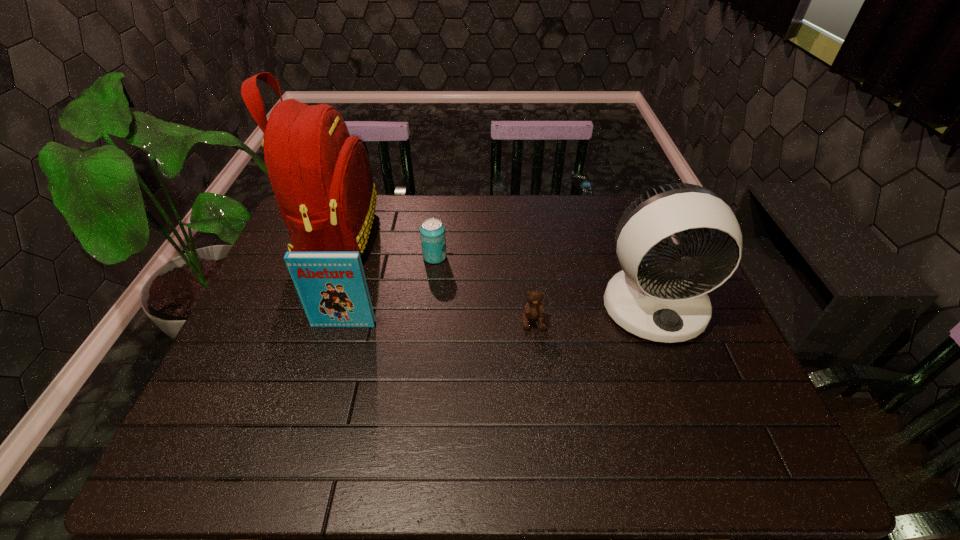
Locate an element on the screen. vacant point at the right edge is located at coordinates (722, 354).

Find the location of a particular element. vacant space at the near left corner of the desktop is located at coordinates (175, 468).

This screenshot has width=960, height=540. What are the coordinates of `free space at the near right corner` in the screenshot? It's located at (757, 471).

The height and width of the screenshot is (540, 960). What are the coordinates of `empty space between the third tallest object and the fan` in the screenshot? It's located at (498, 315).

At what (x,y) coordinates should I click in order to perform the action: click on vacant space that's between the backpack and the beer can. Please return your answer as a coordinate pair (x, y). The height and width of the screenshot is (540, 960). Looking at the image, I should click on 386,247.

Where is `free area in between the third object from right to left and the book`? Image resolution: width=960 pixels, height=540 pixels. free area in between the third object from right to left and the book is located at coordinates (390, 291).

Where is `free space between the tallest object and the fan`? Image resolution: width=960 pixels, height=540 pixels. free space between the tallest object and the fan is located at coordinates (495, 271).

Find the location of a particular element. This screenshot has width=960, height=540. free area in between the beer can and the second object from right to left is located at coordinates (484, 289).

This screenshot has height=540, width=960. What are the coordinates of `free point between the fourth shortest object and the fourth object from left to right` in the screenshot? It's located at (593, 314).

I want to click on vacant space that is in between the fan and the beer can, so click(543, 281).